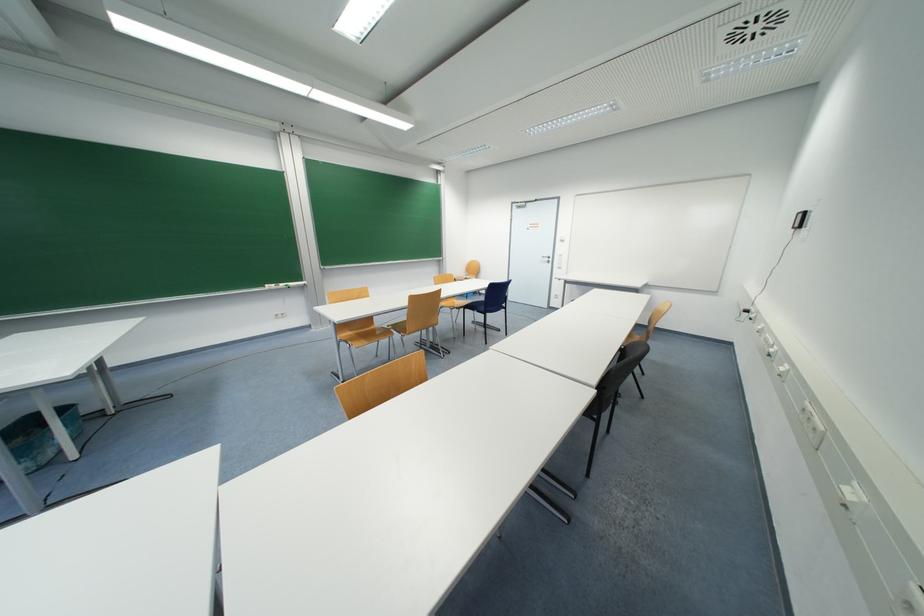
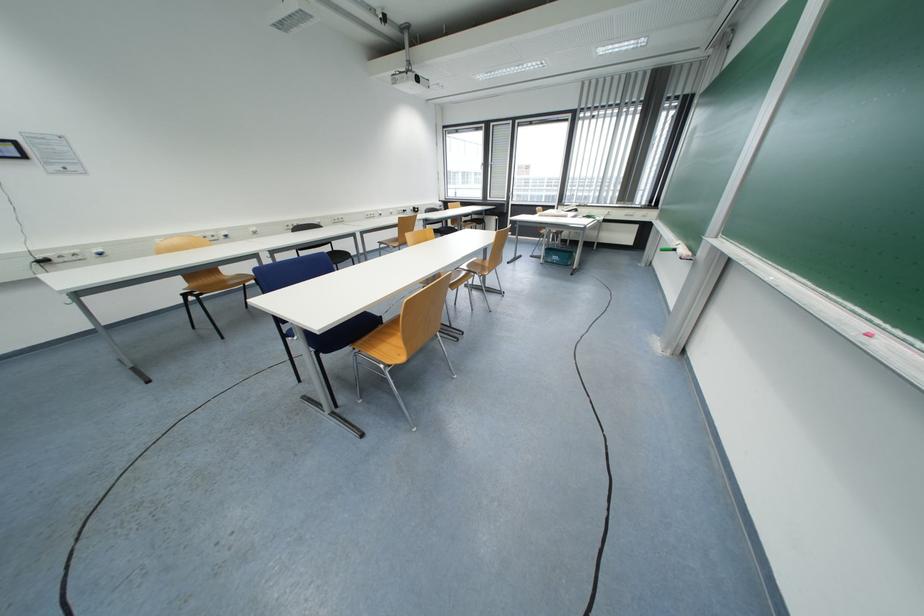
Question: I am providing you with two images of the same scene from different viewpoints. After the viewpoint changes to image2, which objects are now occluded?

Choices:
 (A) blue chair sitting surface
 (B) pink chalk piece
 (C) black chair surface
 (D) white stair railing

Answer: (A)